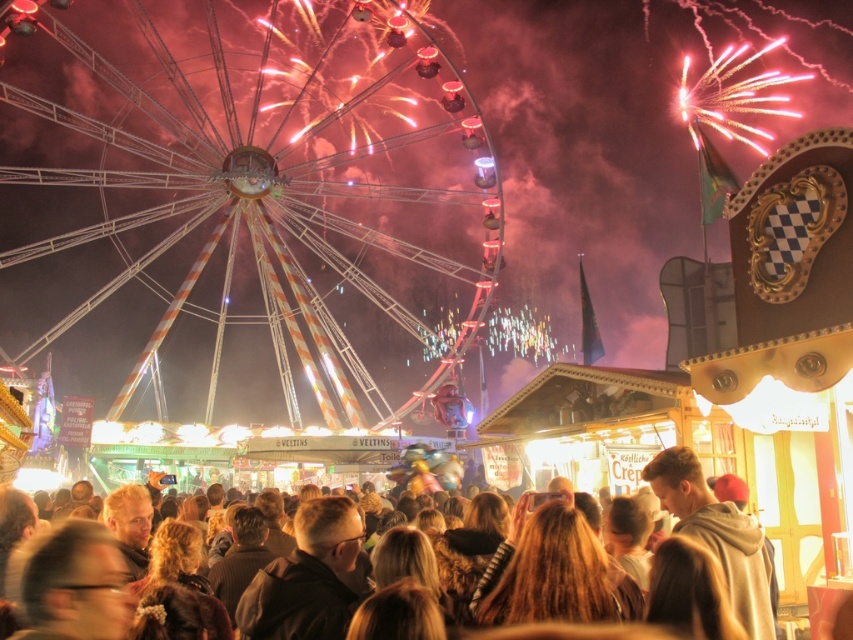
You are standing in the crowd at the fair and see both the metallic ferris wheel at center and the light brown hoodie at center. Which object is positioned to the left from your perspective?

The metallic ferris wheel at center is to the left of the light brown hoodie at center from your perspective.

You are standing at the center of the fairground and see a person with brown hair at center. If you walk straight ahead, will you walk towards the Ferris wheel or away from it?

The brown hair at center is located at point (717, 536), which is towards the lower part of the image. Since the Ferris wheel is the focal point and likely positioned centrally or towards the upper part of the scene, walking straight ahead from the center would take you towards the Ferris wheel.